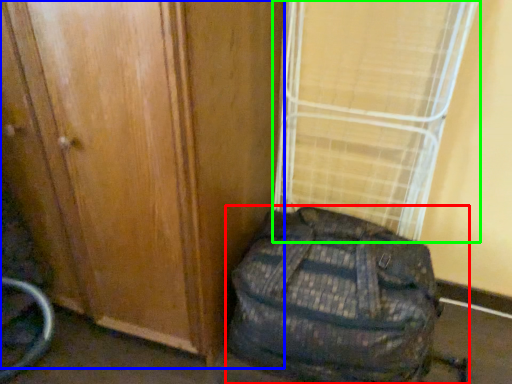
Question: Considering the real-world distances, which object is farthest from backpack (highlighted by a red box)? door (highlighted by a blue box) or curtain (highlighted by a green box)?

Choices:
 (A) door
 (B) curtain

Answer: (B)